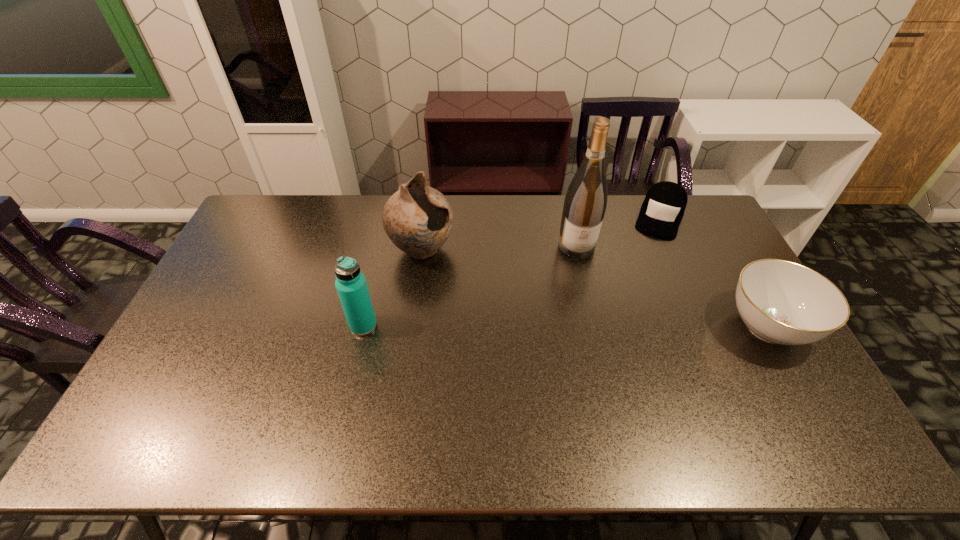
In order to click on object that is the closest to the pottery in this screenshot , I will do `click(351, 286)`.

Locate an element on the screen. The height and width of the screenshot is (540, 960). free point that satisfies the following two spatial constraints: 1. on the back side of the third shortest object; 2. on the right side of the pottery is located at coordinates (381, 250).

The image size is (960, 540). What are the coordinates of `vacant space that satisfies the following two spatial constraints: 1. on the front side of the pottery; 2. on the left side of the chinaware` in the screenshot? It's located at (412, 327).

The width and height of the screenshot is (960, 540). Identify the location of free space that satisfies the following two spatial constraints: 1. on the back side of the pottery; 2. on the left side of the shortest object. (426, 217).